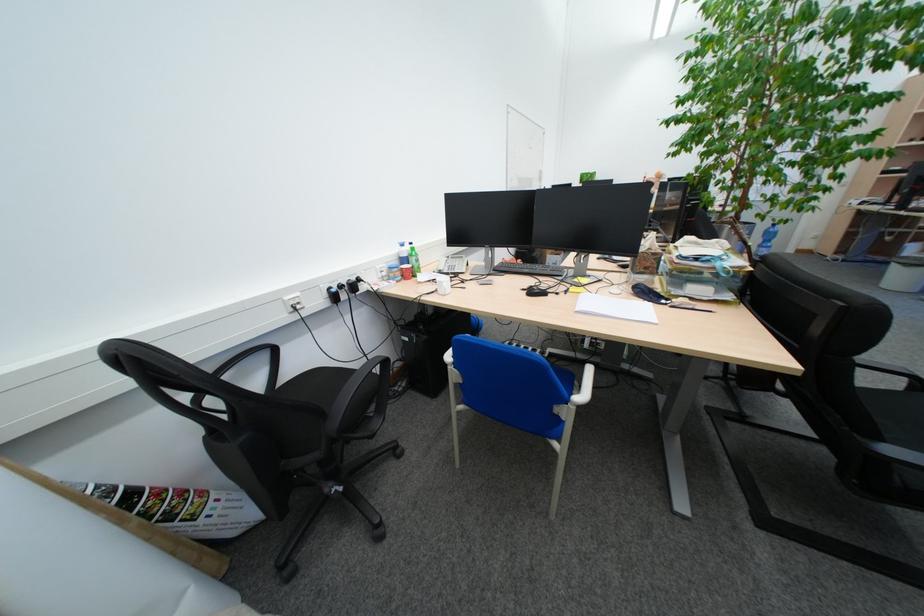
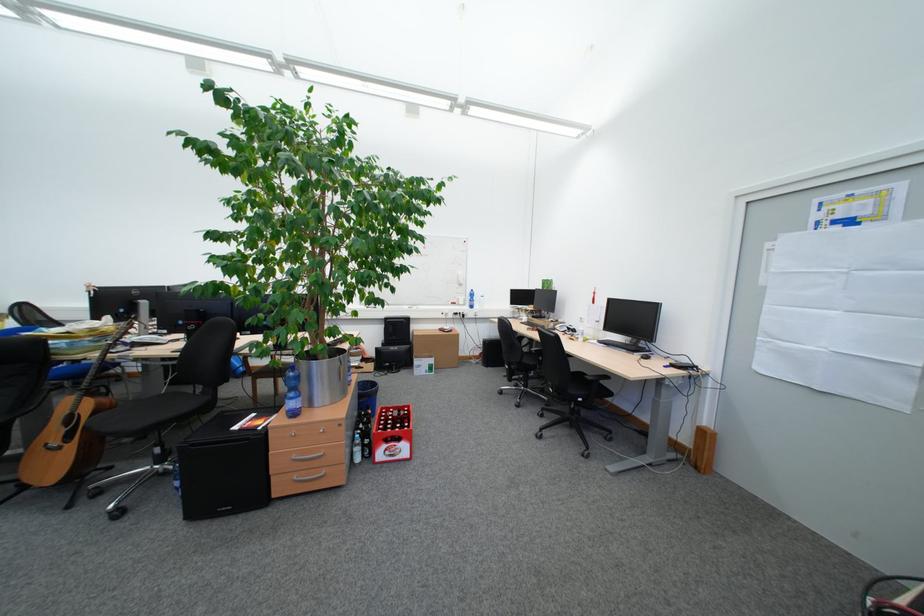
Question: I am providing you with two images of the same scene from different viewpoints. Which of the following objects are not visible in image2?

Choices:
 (A) acoustic guitar
 (B) computer mouse
 (C) phone handset
 (D) wooden storage crate

Answer: (C)